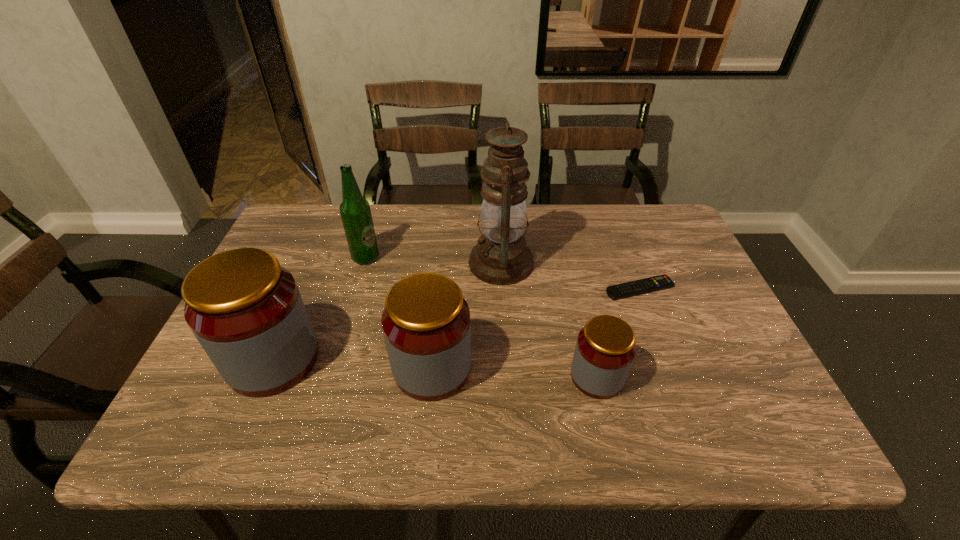
Where is `the leftmost object`? the leftmost object is located at coordinates (246, 311).

Find the location of a particular element. The image size is (960, 540). the second shortest jar is located at coordinates (426, 325).

This screenshot has width=960, height=540. I want to click on the second jar from right to left, so click(x=426, y=325).

Locate an element on the screen. The height and width of the screenshot is (540, 960). the rightmost jar is located at coordinates (605, 349).

I want to click on the second shortest object, so click(605, 349).

Where is `beer bottle`? This screenshot has width=960, height=540. beer bottle is located at coordinates (355, 211).

You are a GUI agent. You are given a task and a screenshot of the screen. Output one action in this format:
    pyautogui.click(x=<x>, y=<y>)
    Task: Click on the tallest object
    
    Given the screenshot: What is the action you would take?
    pyautogui.click(x=501, y=257)

Locate an element on the screen. This screenshot has height=540, width=960. the rightmost object is located at coordinates (661, 282).

Locate an element on the screen. The image size is (960, 540). the shortest object is located at coordinates (661, 282).

Where is `vacant point located 0.200m on the right of the leftmost object`? vacant point located 0.200m on the right of the leftmost object is located at coordinates pos(406,359).